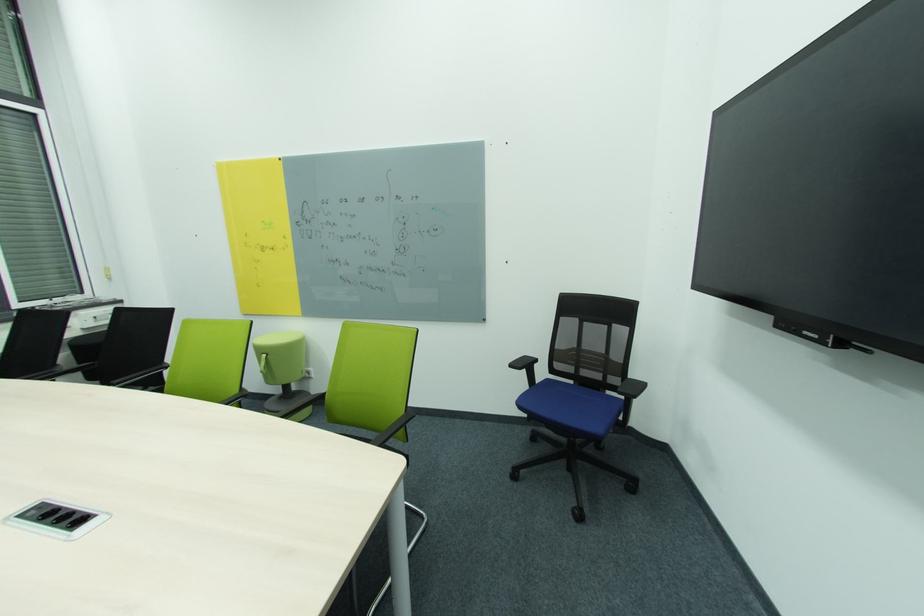
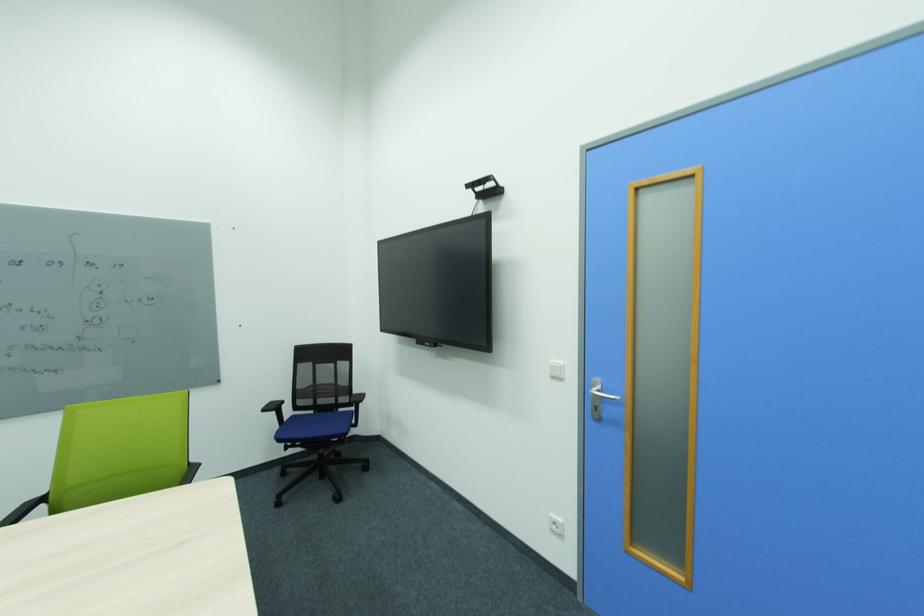
In the second image, find the point that corresponds to [638,376] in the first image.

(360, 392)